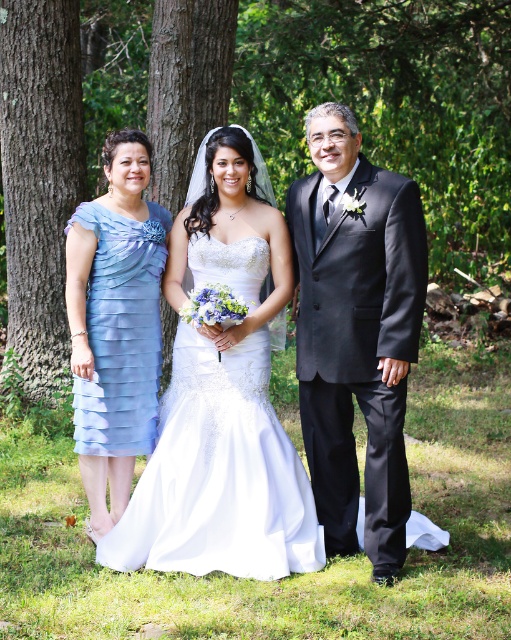
You are a photographer taking pictures of the white satin dress at center and the brown rough tree trunk at left. Which object should you focus on first if you want to capture both in a single frame without moving the camera?

You should focus on the white satin dress at center first because it is closer to the viewer than the brown rough tree trunk at left, so it will be in focus first when adjusting the camera settings.

You are a photographer positioned at the back of the scene. You want to take a photo that includes both the green textured tree at center and the black satin suit at right. Which object should you adjust your camera angle to focus on first to ensure both are in frame?

The green textured tree at center is closer to you than the black satin suit at right, so you should focus on the green textured tree at center first to ensure both are in frame.